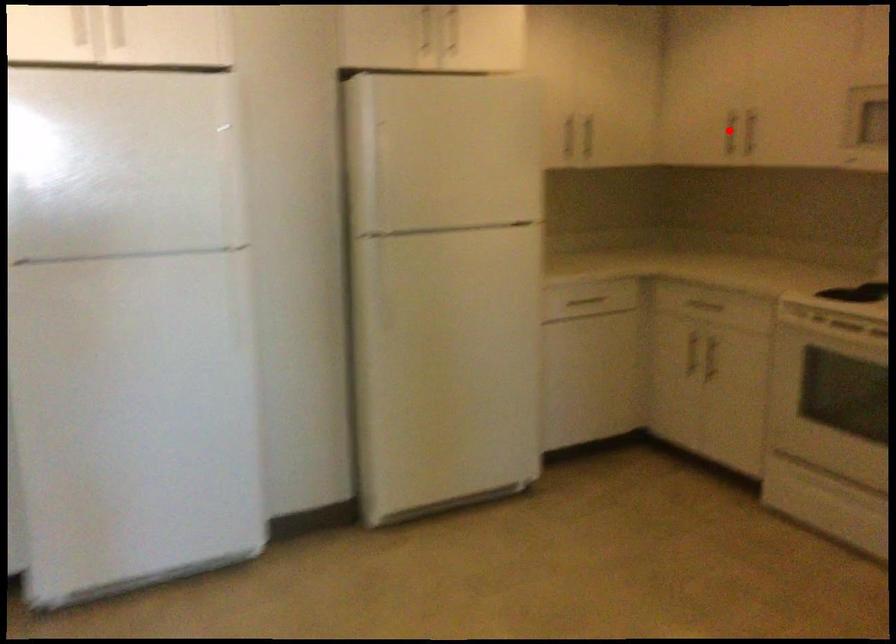
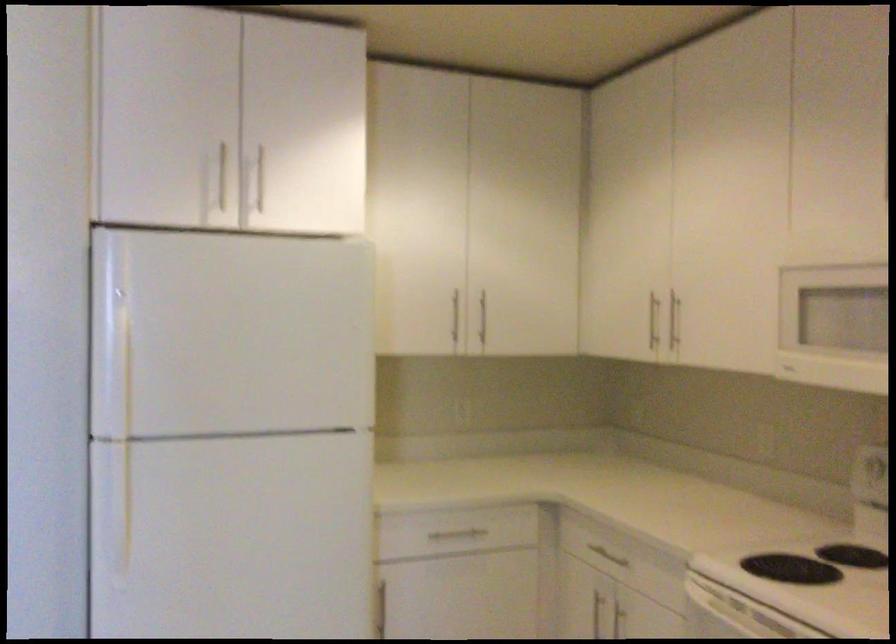
Question: I am providing you with two images of the same scene from different viewpoints. Given a red point in image1, look at the same physical point in image2. Is it:

Choices:
 (A) Closer to the viewpoint
 (B) Farther from the viewpoint

Answer: (A)